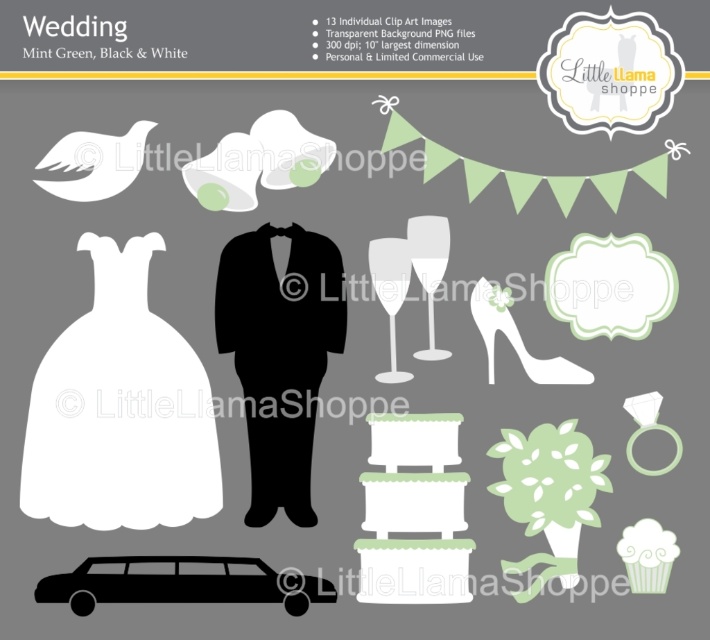
Which is behind, point (143, 288) or point (38, 595)?

The point (143, 288) is behind.

How far apart are white matte dress at left and black matte limousine at lower left?

white matte dress at left and black matte limousine at lower left are 4.54 inches apart.

Is point (195, 387) more distant than point (119, 573)?

Yes, point (195, 387) is behind point (119, 573).

Where is `white matte dress at left`? The width and height of the screenshot is (710, 640). white matte dress at left is located at coordinates coord(120,410).